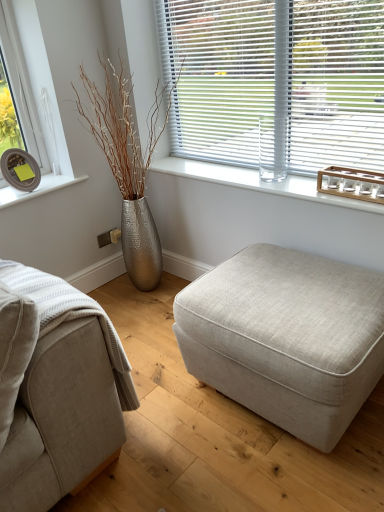
This screenshot has height=512, width=384. I want to click on beige fabric couch at lower left, so click(x=56, y=388).

What do you see at coordinates (257, 182) in the screenshot?
I see `clear glass at upper center` at bounding box center [257, 182].

You are a GUI agent. You are given a task and a screenshot of the screen. Output one action in this format:
    pyautogui.click(x=<x>, y=<y>)
    Task: Click on the clear glass at upper center
    The width and height of the screenshot is (384, 512).
    Given the screenshot: What is the action you would take?
    pyautogui.click(x=257, y=182)

This screenshot has width=384, height=512. Describe the element at coordinates (286, 338) in the screenshot. I see `beige fabric ottoman at center` at that location.

The image size is (384, 512). I want to click on beige fabric ottoman at center, so click(286, 338).

The width and height of the screenshot is (384, 512). What are the coordinates of `silver textured vase at left` in the screenshot? It's located at (127, 165).

Where is `white plastic blinds at upper center`? The image size is (384, 512). white plastic blinds at upper center is located at coordinates (277, 81).

Between point (376, 102) and point (36, 370), which one is positioned behind?

Positioned behind is point (376, 102).

Can you tell me how much white plastic blinds at upper center and beige fabric couch at lower left differ in facing direction?

The angular difference between white plastic blinds at upper center and beige fabric couch at lower left is 4.91 degrees.

Could you tell me if white plastic blinds at upper center is facing beige fabric couch at lower left?

Yes.

Is the position of white plastic blinds at upper center more distant than that of beige fabric couch at lower left?

Yes, white plastic blinds at upper center is further from the camera.

Is silver textured vase at left positioned beyond the bounds of beige fabric couch at lower left?

Yes, silver textured vase at left is located beyond the bounds of beige fabric couch at lower left.

Can you confirm if silver textured vase at left is bigger than beige fabric couch at lower left?

Yes.

Is silver textured vase at left positioned with its back to beige fabric couch at lower left?

silver textured vase at left is not turned away from beige fabric couch at lower left.

Is beige fabric ottoman at center facing towards clear glass at upper center?

No, beige fabric ottoman at center is not oriented towards clear glass at upper center.

Who is smaller, beige fabric ottoman at center or clear glass at upper center?

clear glass at upper center.

Consider the image. Is beige fabric ottoman at center next to clear glass at upper center?

No, beige fabric ottoman at center is not touching clear glass at upper center.

Based on the photo, how much distance is there between beige fabric ottoman at center and clear glass at upper center?

beige fabric ottoman at center is 23.49 inches away from clear glass at upper center.

From a real-world perspective, who is located lower, clear glass at upper center or white plastic blinds at upper center?

clear glass at upper center is physically lower.

The width and height of the screenshot is (384, 512). In the image, there is a clear glass at upper center. Identify the location of window blind above it (from the image's perspective). (277, 81).

In the image, is clear glass at upper center positioned in front of or behind white plastic blinds at upper center?

Visually, clear glass at upper center is located behind white plastic blinds at upper center.

From a real-world perspective, between clear glass at upper center and silver textured vase at left, who is vertically lower?

silver textured vase at left.

Is clear glass at upper center beside silver textured vase at left?

No, clear glass at upper center is not making contact with silver textured vase at left.

Based on the photo, is clear glass at upper center closer to camera compared to silver textured vase at left?

Yes, clear glass at upper center is in front of silver textured vase at left.

Which of these two, beige fabric ottoman at center or white plastic blinds at upper center, is thinner?

white plastic blinds at upper center.

Does beige fabric ottoman at center come in front of white plastic blinds at upper center?

Yes, beige fabric ottoman at center is in front of white plastic blinds at upper center.

This screenshot has width=384, height=512. I want to click on stool on the right of white plastic blinds at upper center, so click(x=286, y=338).

From the image's perspective, who appears lower, beige fabric ottoman at center or white plastic blinds at upper center?

beige fabric ottoman at center is shown below in the image.

From the image's perspective, which one is positioned higher, beige fabric couch at lower left or clear glass at upper center?

clear glass at upper center, from the image's perspective.

Is point (96, 317) closer or farther from the camera than point (262, 186)?

Point (96, 317) is positioned closer to the camera compared to point (262, 186).

Which object is positioned more to the right, beige fabric couch at lower left or clear glass at upper center?

Positioned to the right is clear glass at upper center.

Is beige fabric couch at lower left next to clear glass at upper center?

No, beige fabric couch at lower left is not making contact with clear glass at upper center.

Find the location of a particular element. window blind that is on the right side of beige fabric couch at lower left is located at coordinates (277, 81).

Where is `houseplant above the beige fabric couch at lower left (from the image's perspective)`? The height and width of the screenshot is (512, 384). houseplant above the beige fabric couch at lower left (from the image's perspective) is located at coordinates (127, 165).

Considering their positions, is beige fabric couch at lower left positioned closer to clear glass at upper center than white plastic blinds at upper center?

Based on the image, white plastic blinds at upper center appears to be nearer to clear glass at upper center.

Based on their spatial positions, is clear glass at upper center or white plastic blinds at upper center further from beige fabric ottoman at center?

Among the two, white plastic blinds at upper center is located further to beige fabric ottoman at center.

Based on their spatial positions, is beige fabric couch at lower left or silver textured vase at left further from beige fabric ottoman at center?

silver textured vase at left is positioned further to the anchor beige fabric ottoman at center.

Considering their positions, is white plastic blinds at upper center positioned closer to beige fabric ottoman at center than clear glass at upper center?

clear glass at upper center is positioned closer to the anchor beige fabric ottoman at center.

Estimate the real-world distances between objects in this image. Which object is closer to clear glass at upper center, white plastic blinds at upper center or beige fabric couch at lower left?

Based on the image, white plastic blinds at upper center appears to be nearer to clear glass at upper center.

Which object lies further to the anchor point clear glass at upper center, silver textured vase at left or beige fabric ottoman at center?

Among the two, beige fabric ottoman at center is located further to clear glass at upper center.

From the image, which object appears to be nearer to beige fabric ottoman at center, white plastic blinds at upper center or silver textured vase at left?

white plastic blinds at upper center.

Based on their spatial positions, is white plastic blinds at upper center or clear glass at upper center closer to silver textured vase at left?

clear glass at upper center lies closer to silver textured vase at left than the other object.

Where is `window sill located between beige fabric couch at lower left and beige fabric ottoman at center in the left-right direction`? This screenshot has width=384, height=512. window sill located between beige fabric couch at lower left and beige fabric ottoman at center in the left-right direction is located at coordinates (257, 182).

Locate an element on the screen. window sill located between beige fabric couch at lower left and silver textured vase at left in the depth direction is located at coordinates (257, 182).

Locate an element on the screen. This screenshot has width=384, height=512. window sill situated between silver textured vase at left and white plastic blinds at upper center from left to right is located at coordinates (257, 182).

I want to click on window sill between beige fabric couch at lower left and white plastic blinds at upper center in the horizontal direction, so click(257, 182).